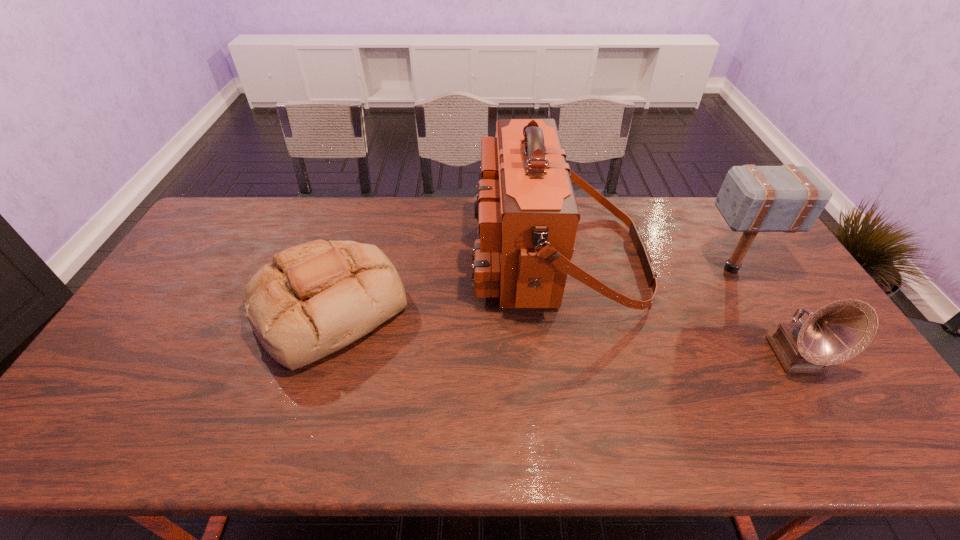
This screenshot has height=540, width=960. What are the coordinates of `vacant point located 0.230m on the striking surface of the third shortest object` in the screenshot? It's located at (624, 269).

At what (x,y) coordinates should I click in order to perform the action: click on free location located on the striking surface of the third shortest object. Please return your answer as a coordinate pair (x, y). Looking at the image, I should click on (634, 269).

The height and width of the screenshot is (540, 960). Find the location of `free space located on the horn of the phonograph record`. free space located on the horn of the phonograph record is located at coordinates (850, 448).

You are a GUI agent. You are given a task and a screenshot of the screen. Output one action in this format:
    pyautogui.click(x=<x>, y=<y>)
    Task: Click on the free space located on the front of the shortest object
    The width and height of the screenshot is (960, 540).
    Given the screenshot: What is the action you would take?
    pyautogui.click(x=284, y=449)

This screenshot has height=540, width=960. In order to click on object that is positioned at the far edge in this screenshot , I will do `click(527, 213)`.

Identify the location of mallet situated at the right edge. (788, 198).

What are the coordinates of `phonograph record present at the right edge` in the screenshot? It's located at (837, 332).

This screenshot has height=540, width=960. In order to click on vacant space at the far edge of the desktop in this screenshot , I will do `click(265, 237)`.

The height and width of the screenshot is (540, 960). I want to click on vacant space at the near edge of the desktop, so click(x=125, y=443).

In the image, there is a desktop. Where is `vacant space at the left edge`? vacant space at the left edge is located at coordinates (138, 373).